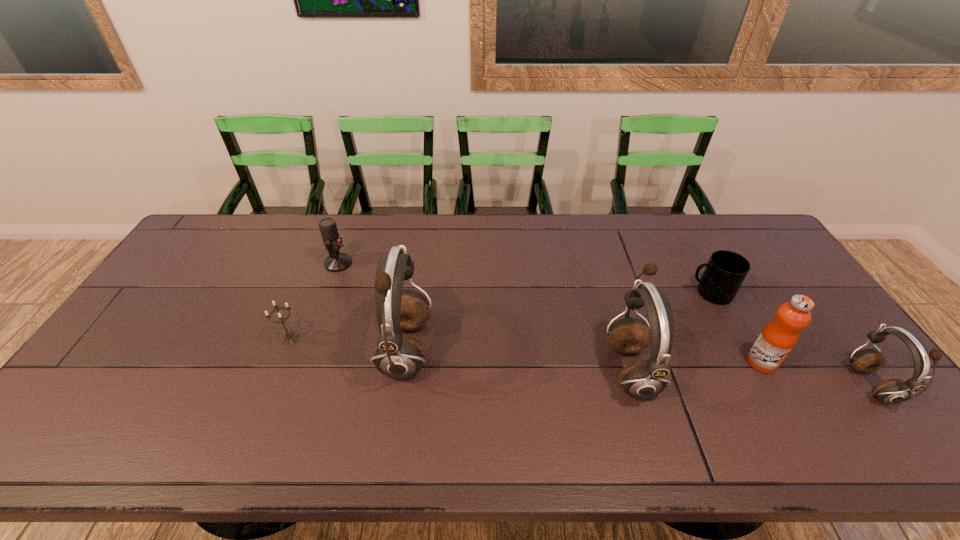
Identify the location of object positioned at the far edge. (335, 262).

The image size is (960, 540). I want to click on object that is at the right edge, so click(889, 391).

This screenshot has width=960, height=540. Find the location of `object that is at the near right corner`. object that is at the near right corner is located at coordinates (889, 391).

Where is `vacant space at the far edge`? vacant space at the far edge is located at coordinates (298, 255).

You are a GUI agent. You are given a task and a screenshot of the screen. Output one action in this format:
    pyautogui.click(x=<x>, y=<y>)
    Task: Click on the free space at the near edge
    
    Given the screenshot: What is the action you would take?
    pyautogui.click(x=360, y=396)

Locate an element on the screen. Image resolution: width=960 pixels, height=540 pixels. vacant space at the left edge of the desktop is located at coordinates (211, 286).

In the image, there is a desktop. Where is `vacant space at the far left corner`? The width and height of the screenshot is (960, 540). vacant space at the far left corner is located at coordinates (217, 223).

This screenshot has width=960, height=540. I want to click on empty space between the fifth tallest object and the second earphone from left to right, so click(484, 315).

At what (x,y) coordinates should I click in order to perform the action: click on free point between the fruit juice and the fourth object from right to left. Please return your answer as a coordinate pair (x, y). Looking at the image, I should click on (696, 365).

The height and width of the screenshot is (540, 960). I want to click on empty location between the rightmost earphone and the fruit juice, so [816, 374].